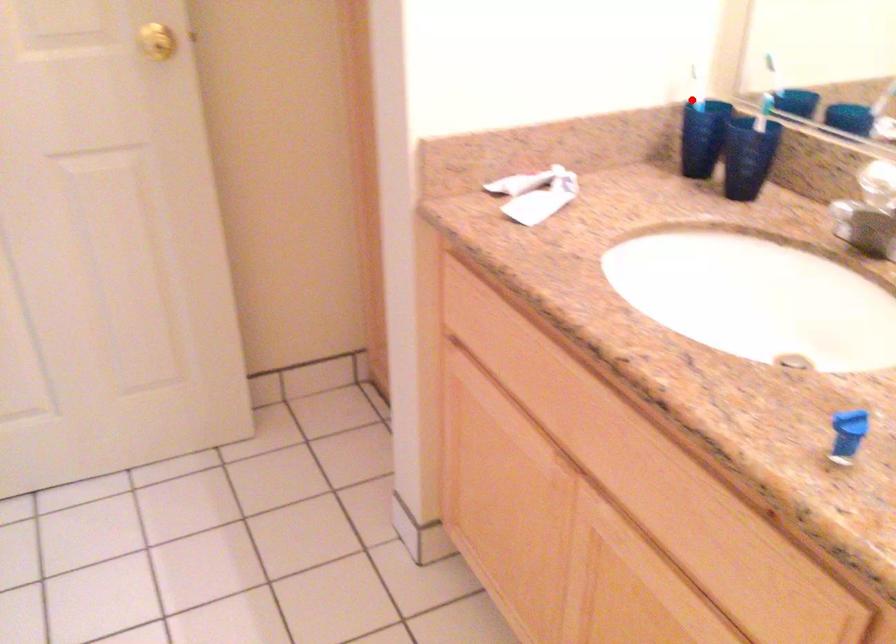
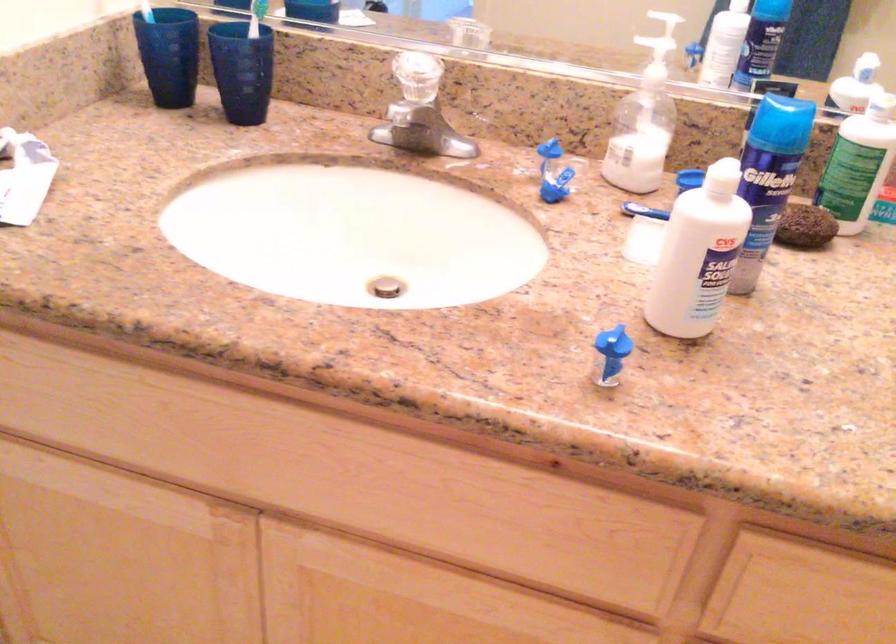
The point at the highlighted location is marked in the first image. Where is the corresponding point in the second image?

(147, 11)